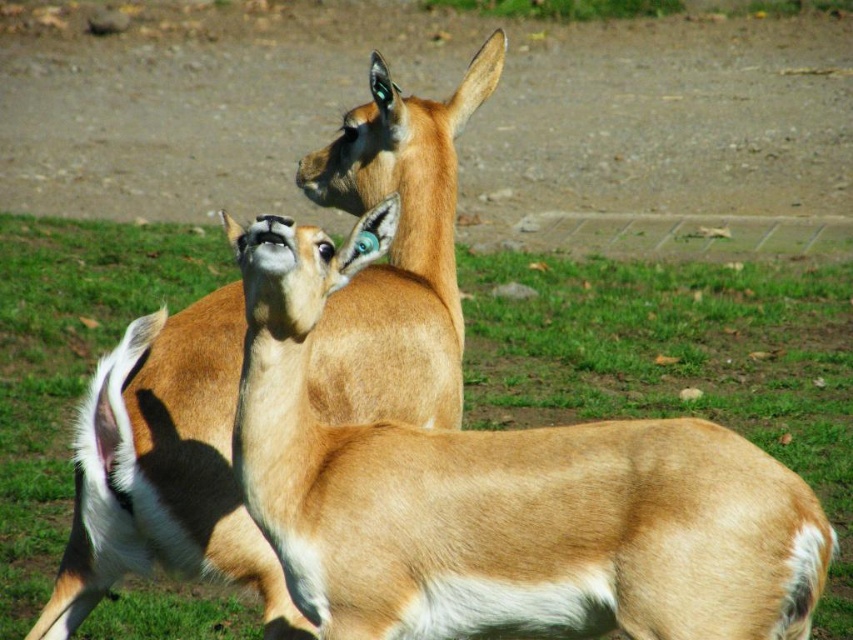
What is the 2D coordinate of the brown furry deer at center in the image?

The 2D coordinate of the brown furry deer at center is at point [502,499].

You are a wildlife photographer aiming to capture a photo of the brown furry deer at center. You want to ensure that both animals are in focus. Given that your camera has a depth of field that can cover 8 feet, will both animals be in focus?

The two animals are 8.14 feet apart. Since the depth of field can cover 8 feet, which is less than the distance between them, not both animals will be in focus.

You are a wildlife photographer trying to capture both brown furry deer at center and brown furry deer at upper center in a single frame. Which deer should you focus on first to ensure both are in the frame without moving your camera position?

You should focus on the brown furry deer at center first because it is larger in width than the brown furry deer at upper center, ensuring it fits within the frame while the smaller one can also be captured without adjustment.